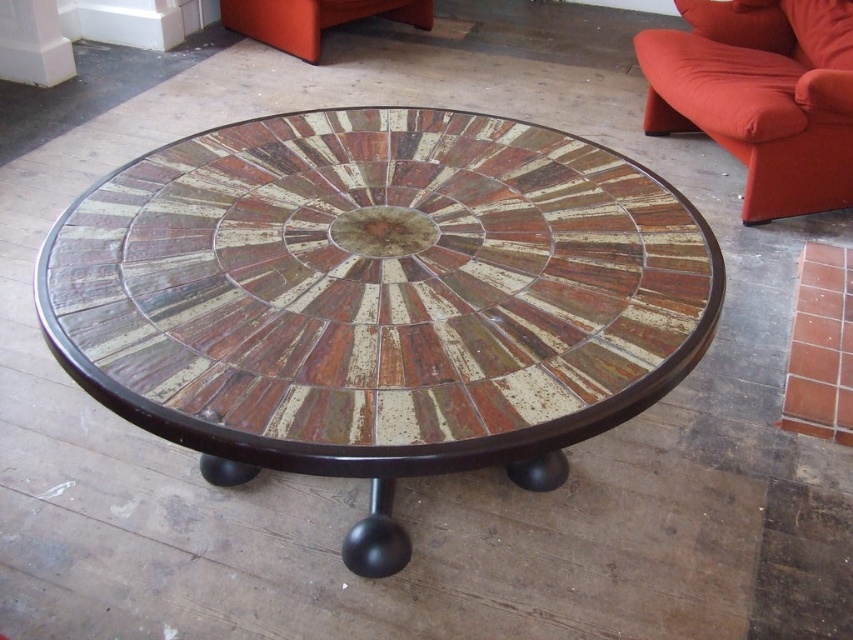
Question: Which point appears farthest from the camera in this image?

Choices:
 (A) (204, 278)
 (B) (727, 35)

Answer: (B)

Question: Does wooden mosaic table at center appear over velvet orange couch at right?

Choices:
 (A) yes
 (B) no

Answer: (B)

Question: Does wooden mosaic table at center lie in front of velvet orange couch at right?

Choices:
 (A) no
 (B) yes

Answer: (B)

Question: Where is wooden mosaic table at center located in relation to velvet orange couch at right in the image?

Choices:
 (A) left
 (B) right

Answer: (A)

Question: Among these points, which one is farthest from the camera?

Choices:
 (A) (701, 60)
 (B) (291, 419)

Answer: (A)